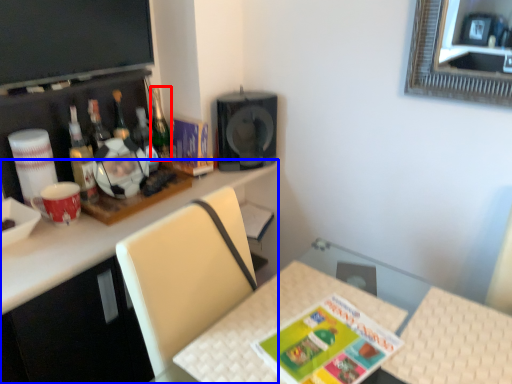
Question: Among these objects, which one is farthest to the camera, bottle (highlighted by a red box) or desk (highlighted by a blue box)?

Choices:
 (A) bottle
 (B) desk

Answer: (A)